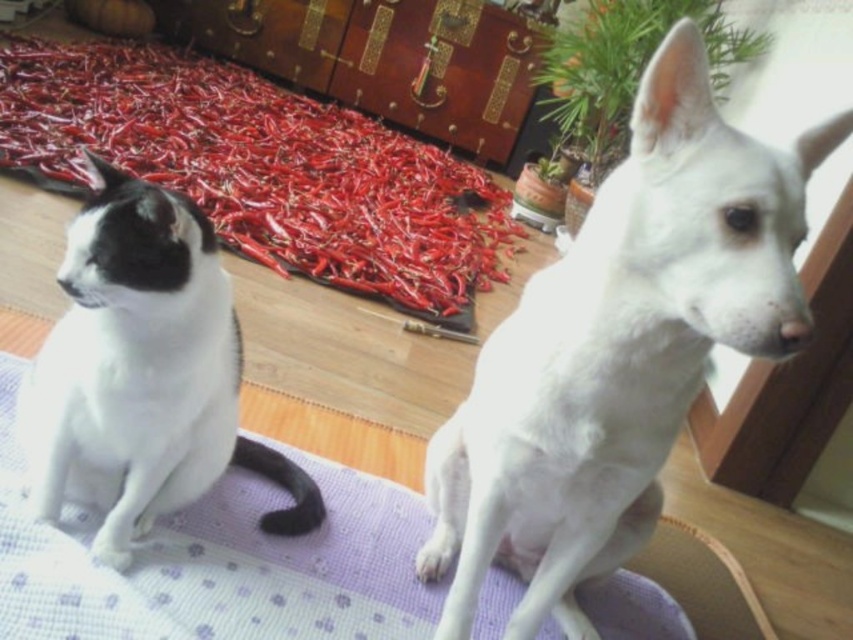
Question: Which object is the closest to the white fur dog at upper right?

Choices:
 (A) red matte peppers at center
 (B) white fur cat at left
 (C) purple fabric mat at center

Answer: (C)

Question: Can you confirm if purple fabric mat at center is positioned to the left of white fur cat at left?

Choices:
 (A) no
 (B) yes

Answer: (A)

Question: Among these objects, which one is nearest to the camera?

Choices:
 (A) white fur dog at upper right
 (B) white fur cat at left
 (C) red matte peppers at center
 (D) purple fabric mat at center

Answer: (A)

Question: Can you confirm if red matte peppers at center is thinner than white fur cat at left?

Choices:
 (A) no
 (B) yes

Answer: (A)

Question: Is purple fabric mat at center closer to the viewer compared to white fur cat at left?

Choices:
 (A) yes
 (B) no

Answer: (B)

Question: Estimate the real-world distances between objects in this image. Which object is closer to the red matte peppers at center?

Choices:
 (A) white fur dog at upper right
 (B) purple fabric mat at center
 (C) white fur cat at left

Answer: (C)